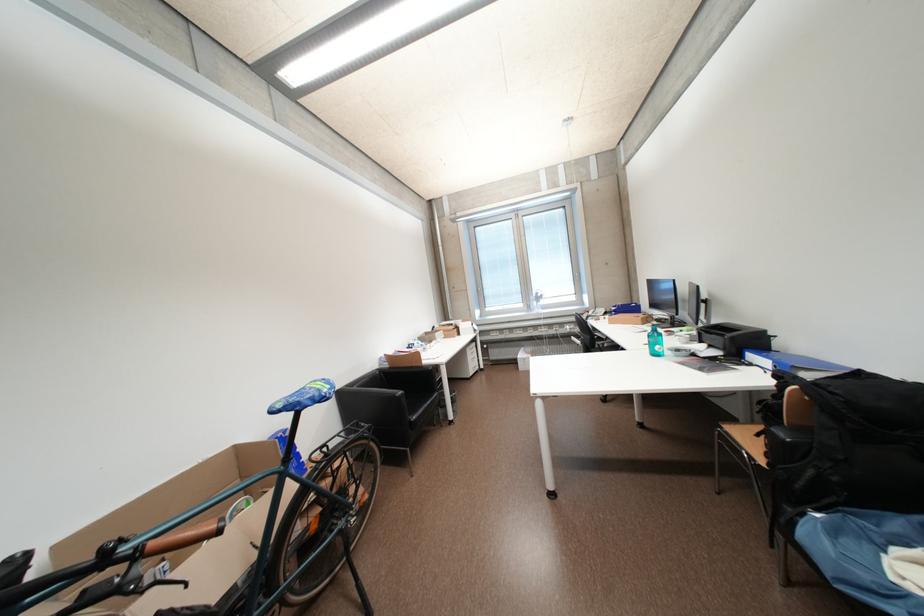
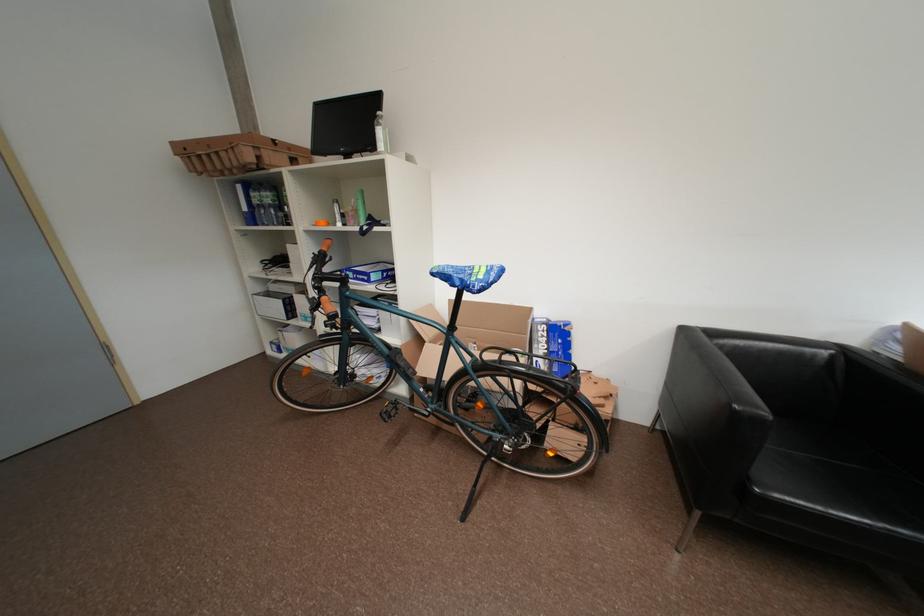
Where in the second image is the point corresponding to (x=335, y=389) from the first image?

(489, 278)